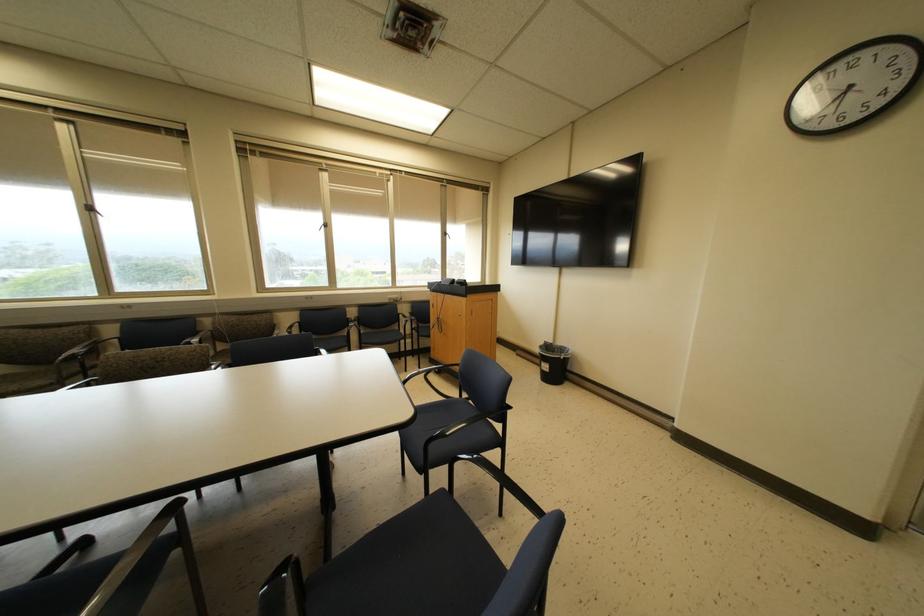
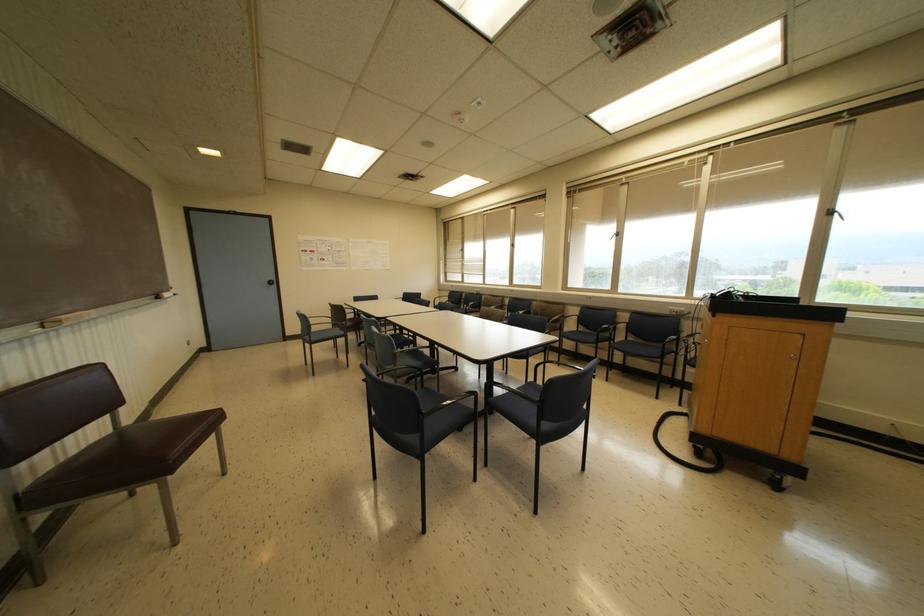
Find the pixel in the second image that matches (444,233) in the first image.

(827, 213)